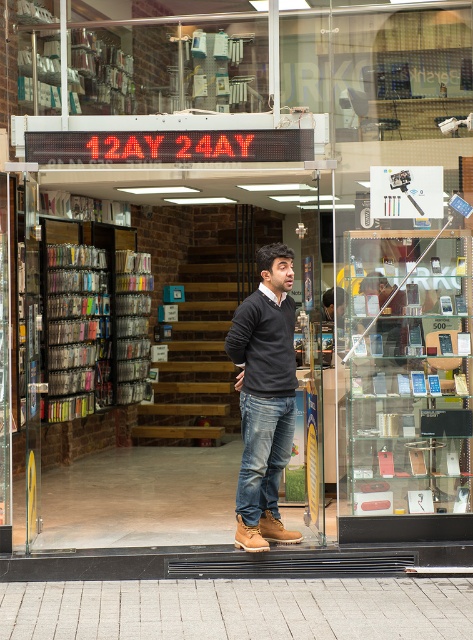
Question: Can you confirm if transparent glass display case at center is positioned below dark gray sweater at center?

Choices:
 (A) no
 (B) yes

Answer: (A)

Question: Which point is farther from the camera taking this photo?

Choices:
 (A) (270, 451)
 (B) (463, 500)
 (C) (98, 326)

Answer: (C)

Question: Does transparent glass display case at center lie behind metallic silver books at left?

Choices:
 (A) no
 (B) yes

Answer: (A)

Question: Among these objects, which one is farthest from the camera?

Choices:
 (A) dark gray sweater at center
 (B) transparent glass display case at center
 (C) metallic silver books at left

Answer: (C)

Question: Is transparent glass display case at center further to camera compared to dark gray sweater at center?

Choices:
 (A) no
 (B) yes

Answer: (B)

Question: Which point is closer to the camera taking this photo?

Choices:
 (A) (46, 310)
 (B) (450, 525)

Answer: (B)